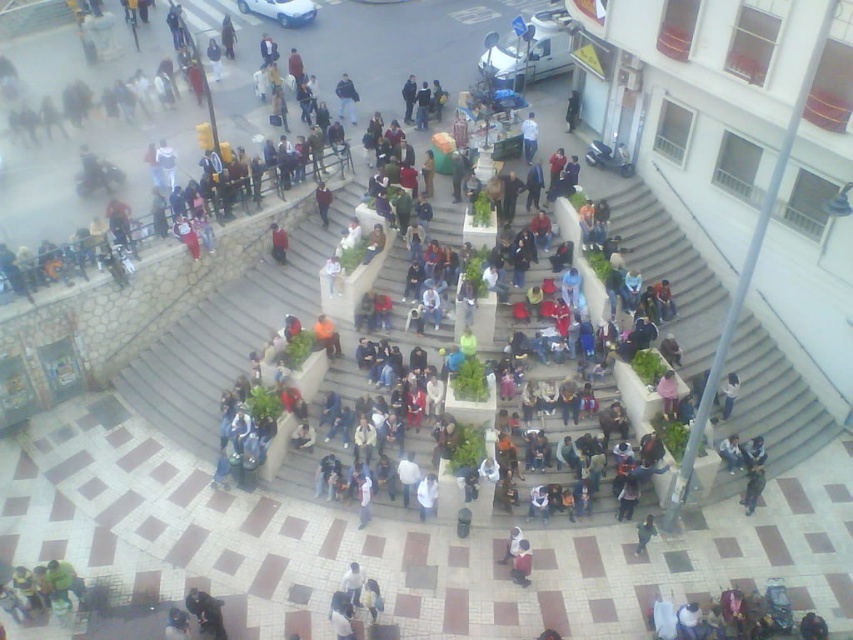
You are standing at the edge of the plaza and want to reach the white concrete stairs at center. According to the scene description, where exactly are the stairs positioned?

The white concrete stairs at center are located at point (670,272).

You are a photographer trying to capture a photo of the dark blue sweater at center without including the white concrete stairs at center in the frame. Is this possible based on their sizes?

The white concrete stairs at center is larger in size than the dark blue sweater at center. Since the stairs are larger, they might occupy more of the frame, making it difficult to exclude them entirely unless the photographer moves closer to the sweater or uses a zoom lens to focus specifically on the sweater.

You are standing on the white concrete stairs at center and want to move to the dark blue sweater at center. Which direction should you move to reach it?

The white concrete stairs at center is positioned on the right side of the dark blue sweater at center, so you should move to the left to reach it.